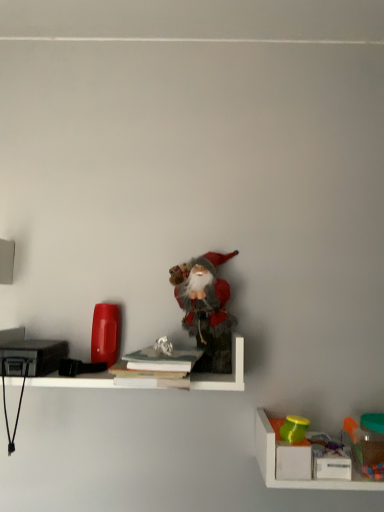
Question: From the image's perspective, relative to translucent plastic container at lower right, marked as the third toy in a top-to-bottom arrangement, is matte green cup at lower right, placed as the 2th toy when sorted from bottom to top, above or below?

Choices:
 (A) below
 (B) above

Answer: (B)

Question: Considering the positions of matte green cup at lower right, placed as the second toy when sorted from right to left, and translucent plastic container at lower right, marked as the third toy in a top-to-bottom arrangement, in the image, is matte green cup at lower right, placed as the second toy when sorted from right to left, bigger or smaller than translucent plastic container at lower right, marked as the third toy in a top-to-bottom arrangement,?

Choices:
 (A) big
 (B) small

Answer: (B)

Question: Estimate the real-world distances between objects in this image. Which object is closer to the white paper at center, the 1th book positioned from the top?

Choices:
 (A) fuzzy fabric santa at center, the first toy from the left
 (B) white matte shelf at center, the second shelf ordered from the bottom
 (C) matte green cup at lower right, placed as the 2th toy when sorted from bottom to top
 (D) hardcover book at center, the 1th book positioned from the bottom
 (E) translucent plastic container at lower right, the second shelf viewed from the left

Answer: (D)

Question: Which of these objects is positioned closest to the matte green cup at lower right, positioned as the 2th toy in top-to-bottom order?

Choices:
 (A) hardcover book at center, the 1th book positioned from the bottom
 (B) white paper at center, the 1th book positioned from the top
 (C) fuzzy fabric santa at center, the third toy from the bottom
 (D) white matte shelf at center, the second shelf ordered from the bottom
 (E) translucent plastic container at lower right, which is the 1th toy in bottom-to-top order

Answer: (E)